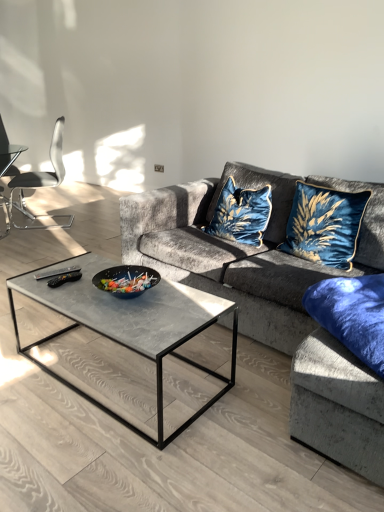
Question: Considering the positions of velvet fabric couch at center and metallic silver chair at left in the image, is velvet fabric couch at center bigger or smaller than metallic silver chair at left?

Choices:
 (A) small
 (B) big

Answer: (B)

Question: Is velvet fabric couch at center to the left or to the right of metallic silver chair at left in the image?

Choices:
 (A) left
 (B) right

Answer: (B)

Question: Which is nearer to the velvet blue cat-shaped pillow at center, arranged as the 1th throw pillow when viewed from the left?

Choices:
 (A) blue velvet pillow at lower right
 (B) concrete gray coffee table at center
 (C) metallic silver chair at left
 (D) velvet blue cushion at upper right, which is the first throw pillow from right to left
 (E) velvet fabric couch at center

Answer: (E)

Question: Which of these objects is positioned farthest from the blue velvet pillow at lower right?

Choices:
 (A) metallic silver chair at left
 (B) velvet blue cushion at upper right, the 2th throw pillow when ordered from left to right
 (C) velvet fabric couch at center
 (D) velvet blue cat-shaped pillow at center, which appears as the 2th throw pillow when viewed from the right
 (E) concrete gray coffee table at center

Answer: (A)